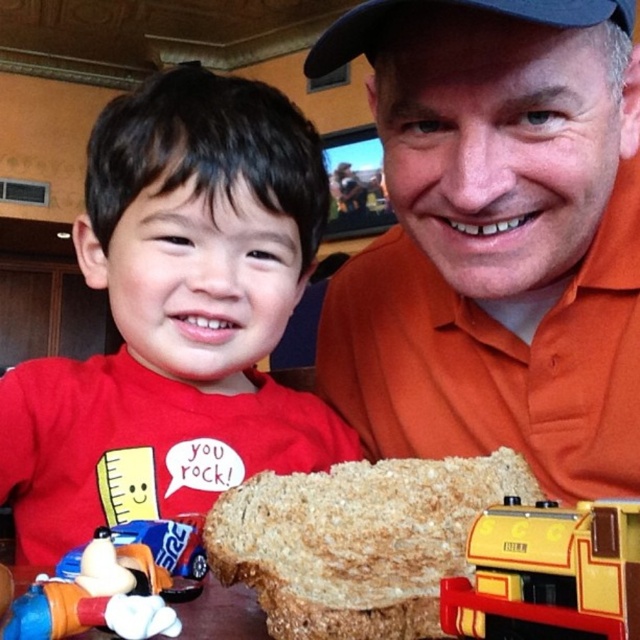
Who is positioned more to the right, matte red shirt at left or black fabric baseball cap at upper center?

From the viewer's perspective, black fabric baseball cap at upper center appears more on the right side.

Looking at this image, which is above, matte red shirt at left or black fabric baseball cap at upper center?

black fabric baseball cap at upper center

Between point (204, 202) and point (604, 8), which one is positioned behind?

The point (204, 202) is behind.

Where is `matte red shirt at left`? This screenshot has width=640, height=640. matte red shirt at left is located at coordinates pos(176,317).

Can you confirm if orange cotton shirt at center is bigger than yellow matte train at lower center?

Yes.

What do you see at coordinates (496, 241) in the screenshot? I see `orange cotton shirt at center` at bounding box center [496, 241].

In order to click on orange cotton shirt at center in this screenshot , I will do `click(496, 241)`.

Can you confirm if orange cotton shirt at center is shorter than brown textured bread at center?

Incorrect, orange cotton shirt at center's height does not fall short of brown textured bread at center's.

Can you confirm if orange cotton shirt at center is positioned above brown textured bread at center?

Yes.

Does point (385, 148) come closer to viewer compared to point (422, 580)?

No, it is behind (422, 580).

Where is `orange cotton shirt at center`? The image size is (640, 640). orange cotton shirt at center is located at coordinates (496, 241).